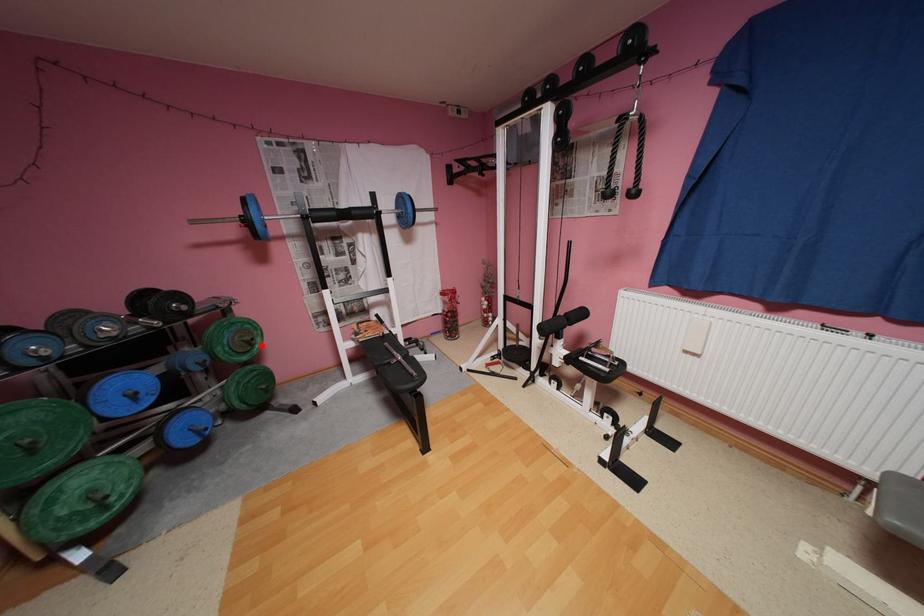
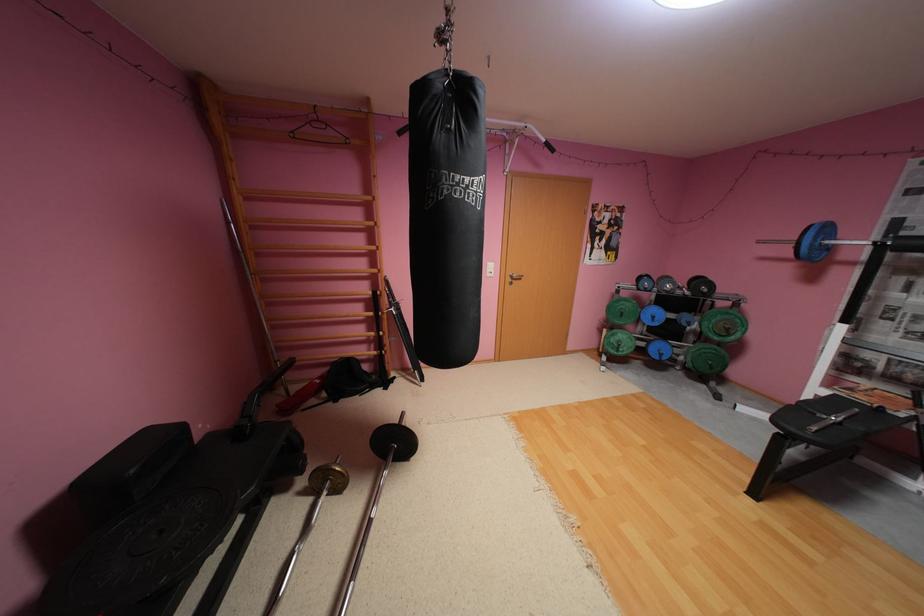
In the second image, find the point that corresponds to the highlighted location in the first image.

(737, 334)